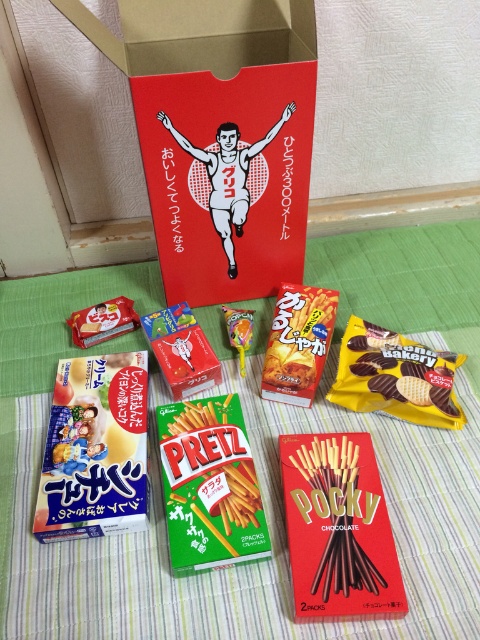
You are organizing a snack display and need to stack items vertically. If you place the red matte cardboard box at upper center on top of the green matte pretzels at center, will the box fit without falling over?

The red matte cardboard box at upper center has a greater height compared to green matte pretzels at center. Since the box is taller, placing it on top might cause instability. A better approach would be to place the taller item at the bottom for stability.